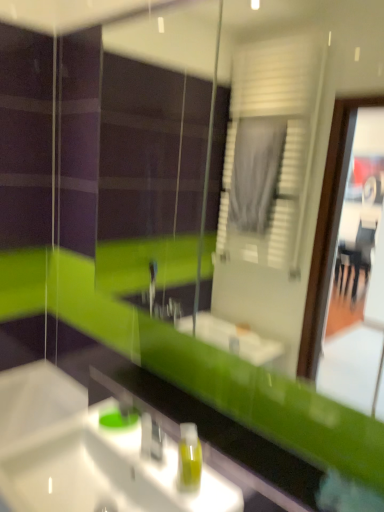
Question: In terms of height, does white glossy sink at lower left look taller or shorter compared to green translucent soap dispenser at lower center?

Choices:
 (A) short
 (B) tall

Answer: (A)

Question: From a real-world perspective, is white glossy sink at lower left above or below green translucent soap dispenser at lower center?

Choices:
 (A) below
 (B) above

Answer: (A)

Question: Which is farther from the green translucent soap dispenser at lower center?

Choices:
 (A) teal glass soap dispenser at center
 (B) white glossy sink at lower left

Answer: (A)

Question: Considering the real-world distances, which object is closest to the green translucent soap dispenser at lower center?

Choices:
 (A) teal glass soap dispenser at center
 (B) white glossy sink at lower left

Answer: (B)